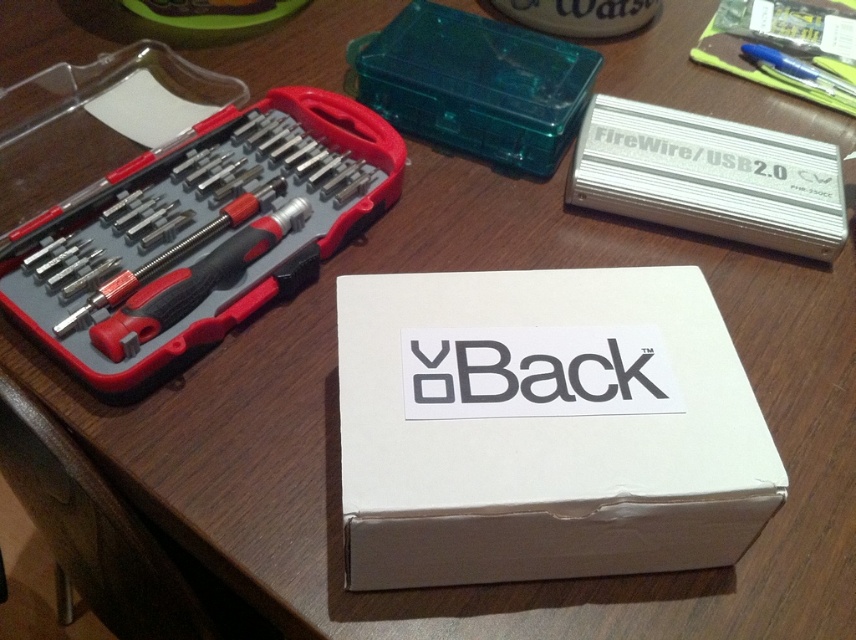
Is the position of white cardboard box at center more distant than that of silver metallic firewire/usb 20 at upper right?

No, it is in front of silver metallic firewire/usb 20 at upper right.

Does white cardboard box at center have a greater height compared to silver metallic firewire/usb 20 at upper right?

Yes, white cardboard box at center is taller than silver metallic firewire/usb 20 at upper right.

You are a GUI agent. You are given a task and a screenshot of the screen. Output one action in this format:
    pyautogui.click(x=<x>, y=<y>)
    Task: Click on the white cardboard box at center
    The width and height of the screenshot is (856, 640).
    Given the screenshot: What is the action you would take?
    point(544,428)

You are a GUI agent. You are given a task and a screenshot of the screen. Output one action in this format:
    pyautogui.click(x=<x>, y=<y>)
    Task: Click on the white cardboard box at center
    Image resolution: width=856 pixels, height=640 pixels.
    Given the screenshot: What is the action you would take?
    pyautogui.click(x=544, y=428)

Is white cardboard box at center to the right of transparent plastic case at upper center from the viewer's perspective?

Indeed, white cardboard box at center is positioned on the right side of transparent plastic case at upper center.

Describe the element at coordinates (544, 428) in the screenshot. This screenshot has height=640, width=856. I see `white cardboard box at center` at that location.

Who is more distant from viewer, (357, 579) or (438, 134)?

The point (438, 134) is behind.

Locate an element on the screen. This screenshot has height=640, width=856. white cardboard box at center is located at coordinates (544, 428).

Which of these two, silver metallic firewire/usb 20 at upper right or transparent plastic case at upper center, stands taller?

With more height is transparent plastic case at upper center.

Who is higher up, silver metallic firewire/usb 20 at upper right or transparent plastic case at upper center?

transparent plastic case at upper center

What do you see at coordinates (709, 177) in the screenshot?
I see `silver metallic firewire/usb 20 at upper right` at bounding box center [709, 177].

Where is `silver metallic firewire/usb 20 at upper right`? This screenshot has width=856, height=640. silver metallic firewire/usb 20 at upper right is located at coordinates (709, 177).